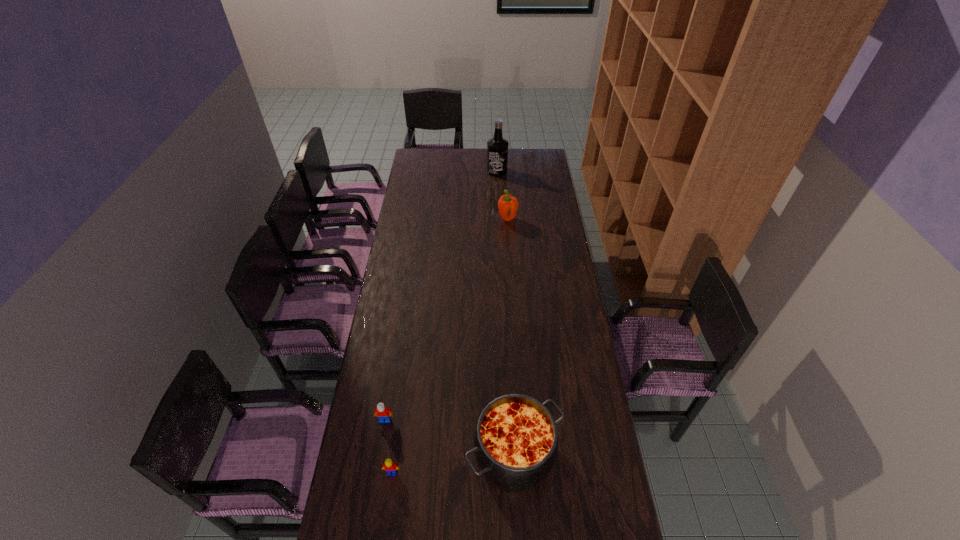
Identify the location of free area in between the taller Lego and the pepper. The height and width of the screenshot is (540, 960). (446, 320).

The image size is (960, 540). Identify the location of free spot between the casserole and the shortest object. (453, 463).

The image size is (960, 540). I want to click on free area in between the nearer Lego and the tallest object, so click(x=444, y=322).

You are a GUI agent. You are given a task and a screenshot of the screen. Output one action in this format:
    pyautogui.click(x=<x>, y=<y>)
    Task: Click on the empty location between the nearer Lego and the tallest object
    The image size is (960, 540).
    Given the screenshot: What is the action you would take?
    pyautogui.click(x=444, y=322)

The width and height of the screenshot is (960, 540). I want to click on free space that is in between the taller Lego and the fourth nearest object, so click(x=446, y=320).

Find the location of a particular element. vacant space that is in between the farther Lego and the pepper is located at coordinates (446, 320).

At what (x,y) coordinates should I click in order to perform the action: click on unoccupied area between the casserole and the shorter Lego. Please return your answer as a coordinate pair (x, y). The height and width of the screenshot is (540, 960). Looking at the image, I should click on (453, 463).

In order to click on free space between the shortest object and the fourth tallest object in this screenshot , I will do `click(389, 446)`.

The image size is (960, 540). What are the coordinates of `vacant area between the nearer Lego and the taller Lego` in the screenshot? It's located at (389, 446).

Identify the location of free space between the nearer Lego and the fourth tallest object. (389, 446).